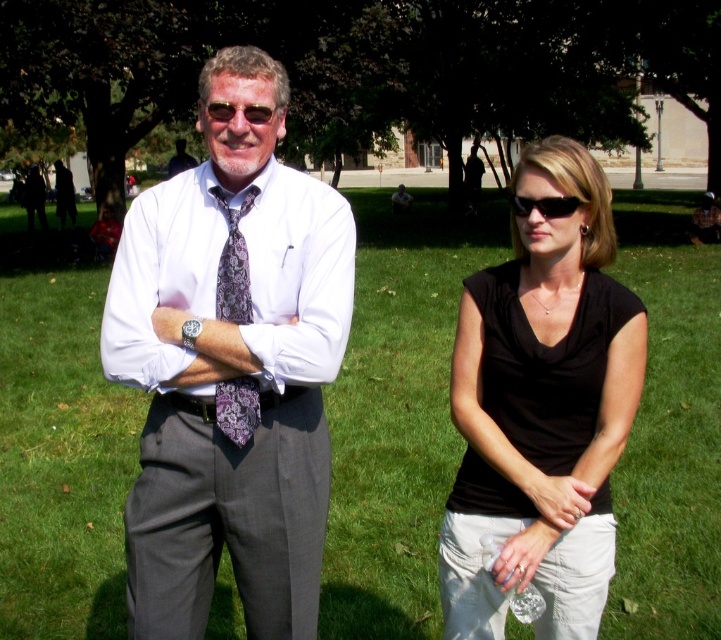
Between matte gray suit at left and matte black shirt at left, which one has less height?

Standing shorter between the two is matte gray suit at left.

Is point (182, 310) less distant than point (17, 195)?

That is True.

I want to click on matte gray suit at left, so click(230, 365).

Which is below, green grass at center or purple floral tie at center?

purple floral tie at center is below.

Between point (428, 348) and point (247, 380), which one is positioned behind?

The point (428, 348) is more distant.

Who is more forward, [647,364] or [244,416]?

Point [244,416]

This screenshot has width=721, height=640. In order to click on green grass at center in this screenshot , I will do `click(397, 413)`.

Which of these two, green grass at center or matte gray suit at left, stands taller?

green grass at center is taller.

Does green grass at center have a larger size compared to matte gray suit at left?

Yes.

Is point (689, 620) closer to camera compared to point (340, 348)?

No, it is not.

Identify the location of green grass at center. click(397, 413).